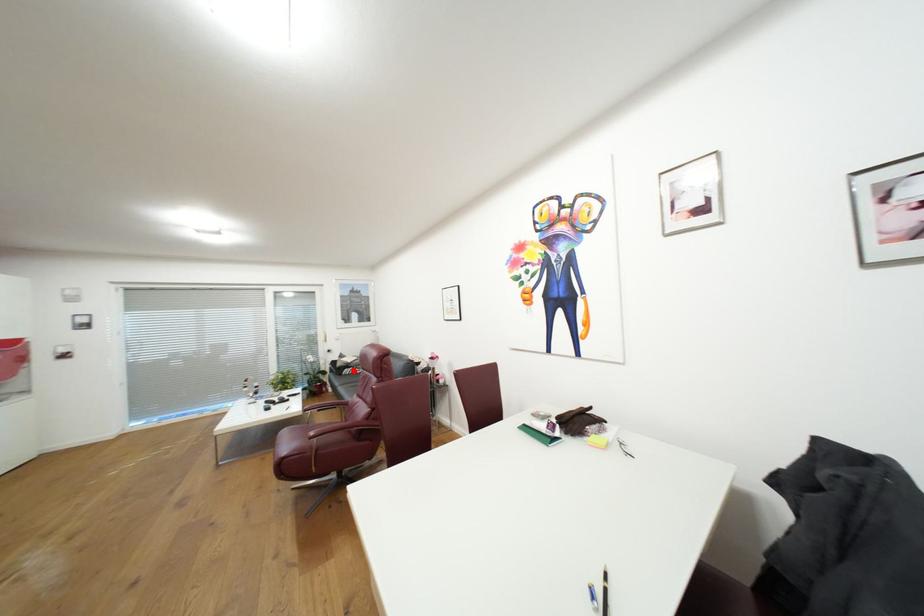
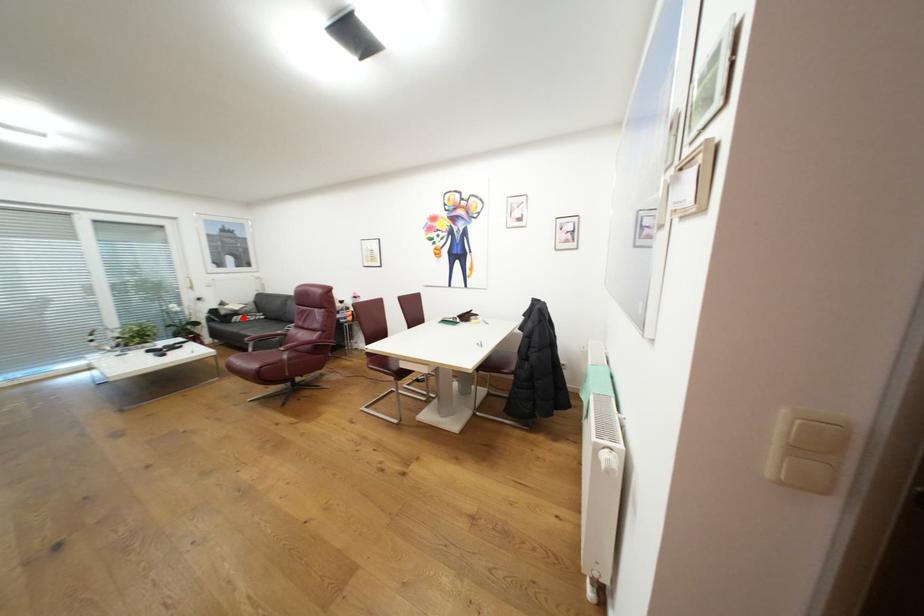
I am providing you with two images of the same scene from different viewpoints. A red point is marked on the first image and another point is marked on the second image. Does the point marked in image1 correspond to the same location as the one in image2?

Yes